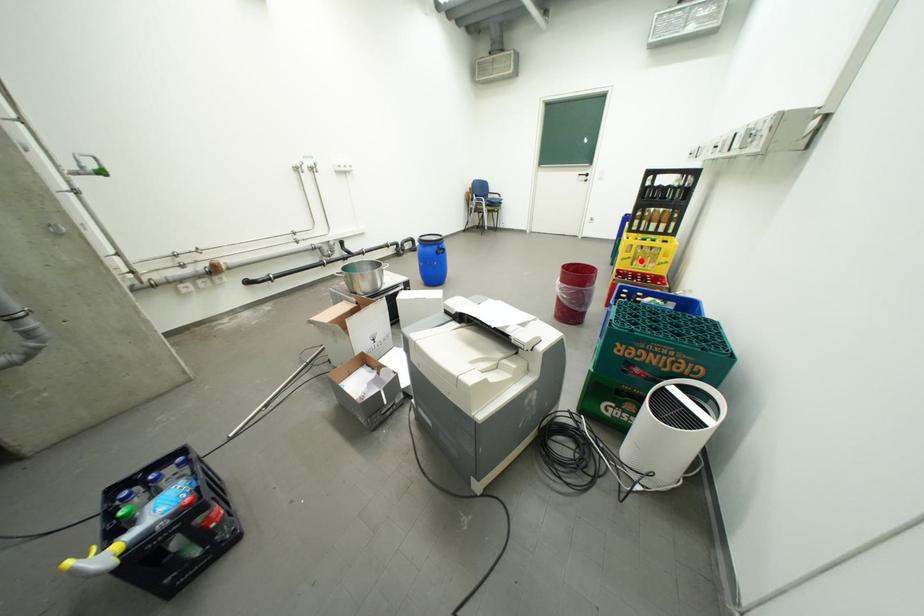
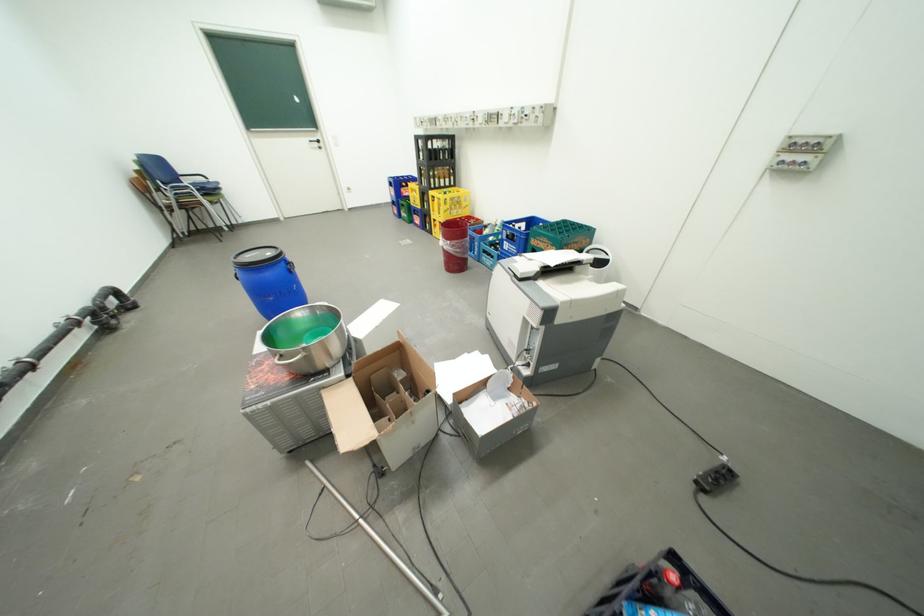
Locate, in the second image, the point that corresponds to the highlighted location in the first image.

(459, 212)